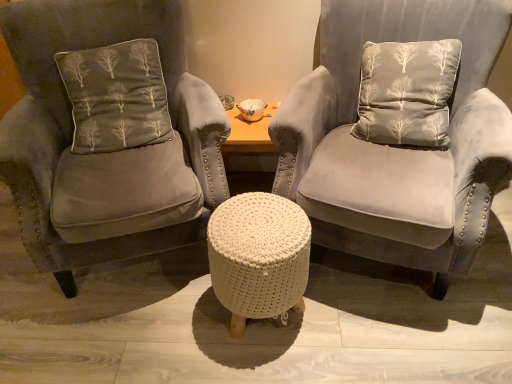
Question: Is dark gray velvet cushion at left positioned in front of white knitted pouf at center?

Choices:
 (A) yes
 (B) no

Answer: (B)

Question: From the image's perspective, is dark gray velvet cushion at left below white knitted pouf at center?

Choices:
 (A) yes
 (B) no

Answer: (B)

Question: From the image's perspective, is dark gray velvet cushion at left located above white knitted pouf at center?

Choices:
 (A) yes
 (B) no

Answer: (A)

Question: Is dark gray velvet cushion at left wider than white knitted pouf at center?

Choices:
 (A) yes
 (B) no

Answer: (B)

Question: Is dark gray velvet cushion at left facing away from white knitted pouf at center?

Choices:
 (A) no
 (B) yes

Answer: (A)

Question: From a real-world perspective, is dark gray velvet cushion at left beneath white knitted pouf at center?

Choices:
 (A) no
 (B) yes

Answer: (A)

Question: Is velvet gray armchair at center, the first chair from the left, thinner than white knitted pouf at center?

Choices:
 (A) no
 (B) yes

Answer: (A)

Question: Considering the relative sizes of velvet gray armchair at center, which ranks as the 2th chair in right-to-left order, and white knitted pouf at center in the image provided, is velvet gray armchair at center, which ranks as the 2th chair in right-to-left order, smaller than white knitted pouf at center?

Choices:
 (A) yes
 (B) no

Answer: (B)

Question: From the image's perspective, is velvet gray armchair at center, the first chair from the left, on top of white knitted pouf at center?

Choices:
 (A) no
 (B) yes

Answer: (B)

Question: Is velvet gray armchair at center, the first chair from the left, facing away from white knitted pouf at center?

Choices:
 (A) yes
 (B) no

Answer: (B)

Question: Does velvet gray armchair at center, which ranks as the 2th chair in right-to-left order, have a lesser height compared to white knitted pouf at center?

Choices:
 (A) no
 (B) yes

Answer: (A)

Question: From the image's perspective, is velvet gray armchair at center, the first chair from the left, beneath white knitted pouf at center?

Choices:
 (A) no
 (B) yes

Answer: (A)

Question: Is white knitted pouf at center surrounded by velvet gray chair at center, arranged as the first chair when viewed from the right?

Choices:
 (A) yes
 (B) no

Answer: (B)